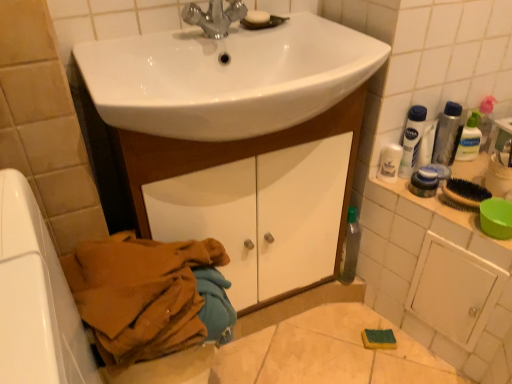
The height and width of the screenshot is (384, 512). Describe the element at coordinates (36, 298) in the screenshot. I see `brown fabric at lower left` at that location.

At what (x,y) coordinates should I click in order to perform the action: click on white plastic container at upper right, positioned as the 2th toiletry in top-to-bottom order. Please return your answer as a coordinate pair (x, y). The height and width of the screenshot is (384, 512). Looking at the image, I should click on (424, 182).

Where is `brown fabric at lower left`? The height and width of the screenshot is (384, 512). brown fabric at lower left is located at coordinates (36, 298).

Is white plastic bottle at upper right in contact with white glossy cabinet at right?

white plastic bottle at upper right and white glossy cabinet at right are not in contact.

Can you confirm if white plastic bottle at upper right is taller than white glossy cabinet at right?

No, white plastic bottle at upper right is not taller than white glossy cabinet at right.

Considering the sizes of objects white plastic bottle at upper right and white glossy cabinet at right in the image provided, who is wider, white plastic bottle at upper right or white glossy cabinet at right?

white glossy cabinet at right is wider.

In terms of size, does white plastic bottle at upper right appear bigger or smaller than white glossy cabinet at right?

Considering their sizes, white plastic bottle at upper right takes up less space than white glossy cabinet at right.

What's the angular difference between white plastic bottle at upper right and white plastic container at upper right, which is the 2th toiletry from back to front,'s facing directions?

The angular difference between white plastic bottle at upper right and white plastic container at upper right, which is the 2th toiletry from back to front, is 0.00101 degrees.

Which is in front, white plastic bottle at upper right or white plastic container at upper right, placed as the first toiletry when sorted from bottom to top?

white plastic bottle at upper right is in front.

From the image's perspective, between white plastic bottle at upper right and white plastic container at upper right, which is the 2th toiletry from back to front, which one is located above?

white plastic bottle at upper right, from the image's perspective.

Is point (419, 131) positioned before point (422, 197)?

Yes, point (419, 131) is closer to viewer.

Would you say white plastic bottle at upper right is inside or outside clear plastic bottle at upper right, the 1th toiletry when ordered from right to left?

white plastic bottle at upper right lies outside clear plastic bottle at upper right, the 1th toiletry when ordered from right to left.

Is point (413, 114) less distant than point (465, 137)?

Yes, it is in front of point (465, 137).

Which of these two, white plastic bottle at upper right or clear plastic bottle at upper right, acting as the second toiletry starting from the bottom, stands shorter?

Standing shorter between the two is clear plastic bottle at upper right, acting as the second toiletry starting from the bottom.

From a real-world perspective, is white plastic bottle at upper right located beneath clear plastic bottle at upper right, acting as the second toiletry starting from the bottom?

No, from a real-world perspective, white plastic bottle at upper right is not below clear plastic bottle at upper right, acting as the second toiletry starting from the bottom.

In terms of size, does clear plastic bottle at upper right, the 1th toiletry when ordered from right to left, appear bigger or smaller than silver metallic faucet at upper center?

Considering their sizes, clear plastic bottle at upper right, the 1th toiletry when ordered from right to left, takes up less space than silver metallic faucet at upper center.

From a real-world perspective, is clear plastic bottle at upper right, positioned as the first toiletry in top-to-bottom order, positioned over silver metallic faucet at upper center based on gravity?

Actually, clear plastic bottle at upper right, positioned as the first toiletry in top-to-bottom order, is physically below silver metallic faucet at upper center in the real world.

In the scene shown: From the image's perspective, does clear plastic bottle at upper right, acting as the second toiletry starting from the bottom, appear higher than silver metallic faucet at upper center?

No, from the image's perspective, clear plastic bottle at upper right, acting as the second toiletry starting from the bottom, is not above silver metallic faucet at upper center.

Can we say clear plastic bottle at upper right, the 2th toiletry in the front-to-back sequence, lies outside silver metallic faucet at upper center?

clear plastic bottle at upper right, the 2th toiletry in the front-to-back sequence, is positioned outside silver metallic faucet at upper center.

Considering the relative sizes of silver metallic faucet at upper center and white glossy mouthwash at upper right, which is counted as the second mouthwash, starting from the right, in the image provided, is silver metallic faucet at upper center smaller than white glossy mouthwash at upper right, which is counted as the second mouthwash, starting from the right,?

Incorrect, silver metallic faucet at upper center is not smaller in size than white glossy mouthwash at upper right, which is counted as the second mouthwash, starting from the right.

Is point (215, 17) in front of point (392, 149)?

Yes, it is in front of point (392, 149).

Can you confirm if silver metallic faucet at upper center is taller than white glossy mouthwash at upper right, which is counted as the second mouthwash, starting from the right?

Yes.

Does silver metallic faucet at upper center touch white glossy mouthwash at upper right, which is counted as the second mouthwash, starting from the right?

No, silver metallic faucet at upper center is not making contact with white glossy mouthwash at upper right, which is counted as the second mouthwash, starting from the right.

Does brown cotton towels at lower left have a greater height compared to silver metallic mouthwash at upper right, which is the second mouthwash from left to right?

Correct, brown cotton towels at lower left is much taller as silver metallic mouthwash at upper right, which is the second mouthwash from left to right.

Consider the image. Is brown cotton towels at lower left oriented towards silver metallic mouthwash at upper right, which is the second mouthwash from left to right?

No, brown cotton towels at lower left does not turn towards silver metallic mouthwash at upper right, which is the second mouthwash from left to right.

Which of these two, brown cotton towels at lower left or silver metallic mouthwash at upper right, which is the second mouthwash from left to right, is thinner?

With smaller width is silver metallic mouthwash at upper right, which is the second mouthwash from left to right.

From a real-world perspective, which object rests below the other?

In real-world perspective, brown cotton towels at lower left is lower.

Is the depth of white glossy sink at center less than that of white matte soap at upper center?

Yes, it is.

Can you confirm if white glossy sink at center is positioned to the left of white matte soap at upper center?

Correct, you'll find white glossy sink at center to the left of white matte soap at upper center.

Which of these two, white glossy sink at center or white matte soap at upper center, stands shorter?

With less height is white matte soap at upper center.

At what (x,y) coordinates should I click in order to perform the action: click on soap above the white glossy sink at center (from a real-world perspective). Please return your answer as a coordinate pair (x, y). Looking at the image, I should click on (257, 17).

This screenshot has height=384, width=512. I want to click on counter top below the white plastic bottle at upper right (from the image's perspective), so click(x=438, y=278).

The image size is (512, 384). Identify the location of cleaning product positioned vertically above the white plastic container at upper right, placed as the first toiletry when sorted from bottom to top (from a real-world perspective). (412, 140).

Consider the image. Based on their spatial positions, is white glossy mouthwash at upper right, which is counted as the second mouthwash, starting from the right, or white plastic bottle at upper right further from white glossy cabinet at center?

white plastic bottle at upper right is positioned further to the anchor white glossy cabinet at center.

When comparing their distances from brown fabric at lower left, does clear plastic bottle at upper right, acting as the second toiletry starting from the bottom, or white glossy cabinet at center seem closer?

Among the two, white glossy cabinet at center is located nearer to brown fabric at lower left.

In the scene shown: Which object lies further to the anchor point silver metallic mouthwash at upper right, which is the second mouthwash from left to right, white plastic container at upper right, placed as the first toiletry when sorted from bottom to top, or brown fabric at lower left?

brown fabric at lower left lies further to silver metallic mouthwash at upper right, which is the second mouthwash from left to right, than the other object.

Looking at the image, which one is located closer to white plastic bottle at upper right, clear plastic bottle at upper right, the 1th toiletry when ordered from right to left, or white plastic container at upper right, which is the 2th toiletry from back to front?

white plastic container at upper right, which is the 2th toiletry from back to front, is closer to white plastic bottle at upper right.

Estimate the real-world distances between objects in this image. Which object is closer to brown cotton towels at lower left, white glossy cabinet at center or white glossy cabinet at right?

white glossy cabinet at center is closer to brown cotton towels at lower left.

From the picture: From the image, which object appears to be farther from white matte soap at upper center, brown cotton towels at lower left or brown fabric at lower left?

brown fabric at lower left is positioned further to the anchor white matte soap at upper center.

Looking at this image, considering their positions, is white matte soap at upper center positioned closer to white plastic container at upper right, the 1th toiletry positioned from the front, than white glossy mouthwash at upper right, arranged as the 1th mouthwash when viewed from the left?

The object closer to white plastic container at upper right, the 1th toiletry positioned from the front, is white glossy mouthwash at upper right, arranged as the 1th mouthwash when viewed from the left.

Considering their positions, is clear plastic bottle at upper right, which appears as the 1th toiletry when viewed from the back, positioned closer to white glossy mouthwash at upper right, which is counted as the second mouthwash, starting from the right, than silver metallic mouthwash at upper right, positioned as the first mouthwash in right-to-left order?

The object closer to white glossy mouthwash at upper right, which is counted as the second mouthwash, starting from the right, is silver metallic mouthwash at upper right, positioned as the first mouthwash in right-to-left order.

Identify the location of laundry located between brown fabric at lower left and white glossy mouthwash at upper right, which is counted as the second mouthwash, starting from the right, in the depth direction. (149, 296).

Where is `soap situated between brown cotton towels at lower left and clear plastic bottle at upper right, acting as the second toiletry starting from the bottom, from left to right`? soap situated between brown cotton towels at lower left and clear plastic bottle at upper right, acting as the second toiletry starting from the bottom, from left to right is located at coordinates (257, 17).

You are a GUI agent. You are given a task and a screenshot of the screen. Output one action in this format:
    pyautogui.click(x=<x>, y=<y>)
    Task: Click on the bathroom cabinet that lies between silver metallic faucet at upper center and brown fabric at lower left from top to bottom
    
    Given the screenshot: What is the action you would take?
    pyautogui.click(x=236, y=160)

At what (x,y) coordinates should I click in order to perform the action: click on bathroom cabinet positioned between brown fabric at lower left and white glossy mouthwash at upper right, which is counted as the second mouthwash, starting from the right, from near to far. Please return your answer as a coordinate pair (x, y). Looking at the image, I should click on (236, 160).